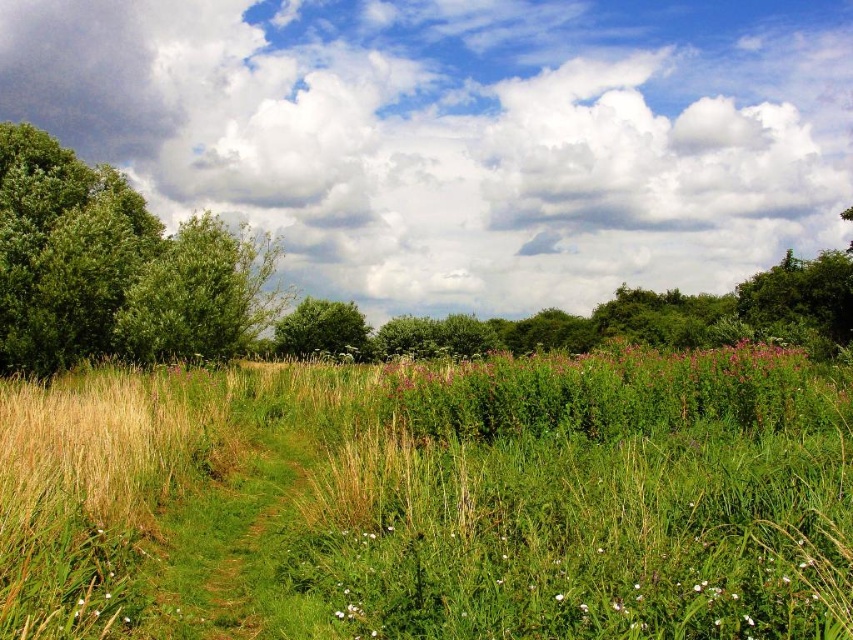
Which is above, purple matte flowers at center or green leafy tree at center?

purple matte flowers at center is above.

What do you see at coordinates (611, 374) in the screenshot? This screenshot has height=640, width=853. I see `purple matte flowers at center` at bounding box center [611, 374].

Where is `purple matte flowers at center`? purple matte flowers at center is located at coordinates (611, 374).

Is green leafy tree at left taller than green leafy tree at center?

Yes, green leafy tree at left is taller than green leafy tree at center.

Can you confirm if green leafy tree at left is positioned to the left of green leafy tree at center?

Indeed, green leafy tree at left is positioned on the left side of green leafy tree at center.

Where is `green leafy tree at left`? This screenshot has width=853, height=640. green leafy tree at left is located at coordinates (115, 268).

Who is more distant from viewer, (183, 298) or (503, 392)?

The point (183, 298) is more distant.

Who is lower down, green leafy tree at left or purple matte flowers at center?

purple matte flowers at center

Does point (146, 209) come in front of point (426, 364)?

No, (146, 209) is further to viewer.

Find the location of a particular element. The width and height of the screenshot is (853, 640). green leafy tree at left is located at coordinates (115, 268).